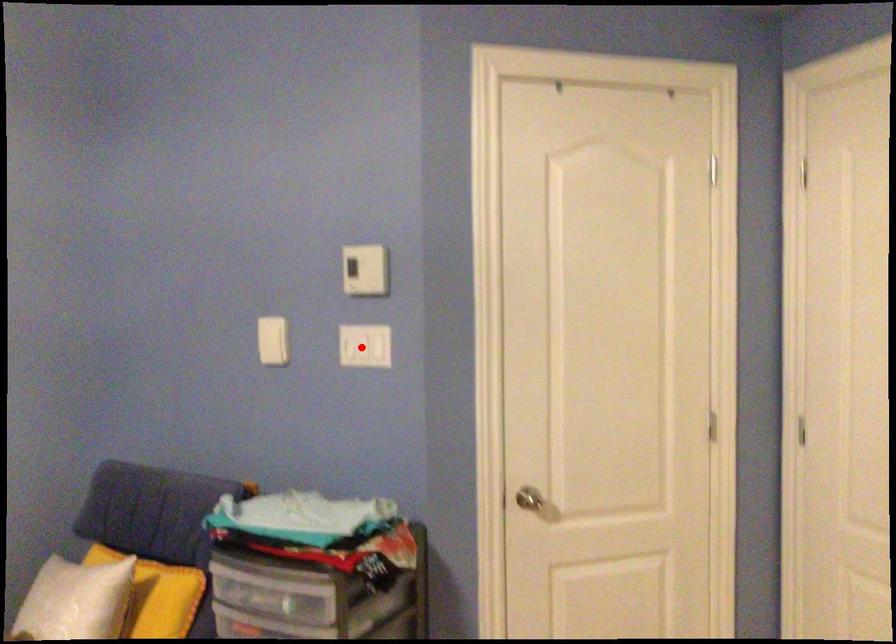
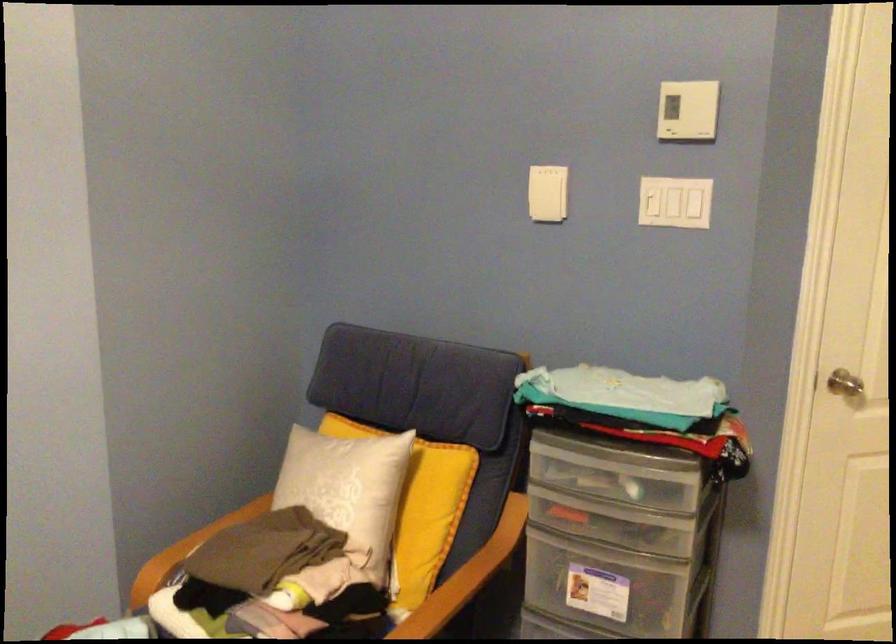
Question: I am providing you with two images of the same scene from different viewpoints. Image1 has a red point marked. In image2, the corresponding 3D location appears at what relative position? Reply with the corresponding letter.

Choices:
 (A) Closer
 (B) Farther

Answer: (A)